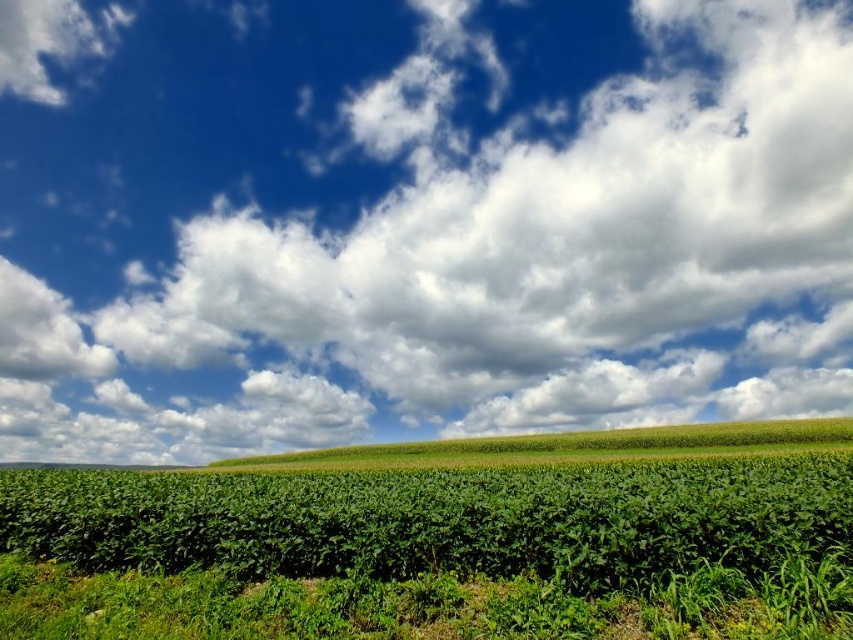
From the picture: Does white fluffy cloud at upper center have a smaller size compared to green leafy corn at center?

No, white fluffy cloud at upper center is not smaller than green leafy corn at center.

Locate an element on the screen. white fluffy cloud at upper center is located at coordinates (416, 220).